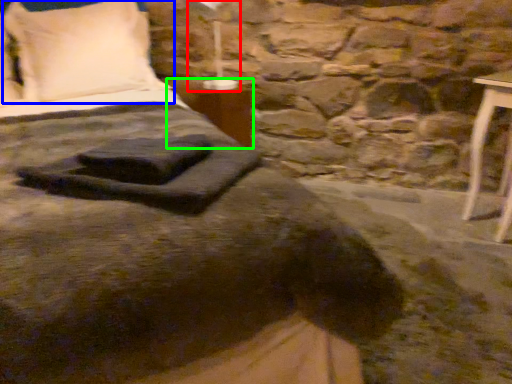
Question: Which is farther away from bedside lamp (highlighted by a red box)? pillow (highlighted by a blue box) or table (highlighted by a green box)?

Choices:
 (A) pillow
 (B) table

Answer: (A)